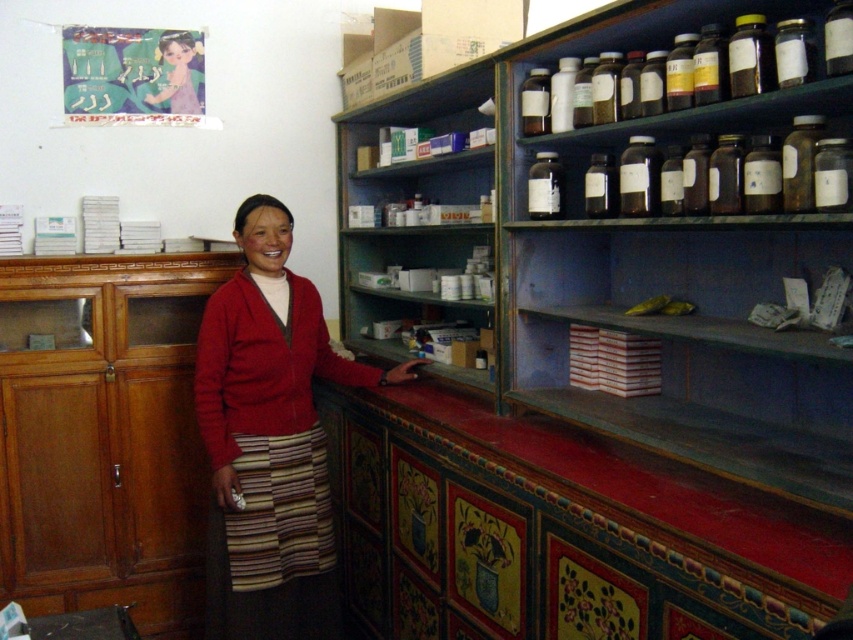
You are a customer in the pharmacy and want to reach both the point at (241, 348) and the point at (817, 112). Which point should you approach first to minimize walking distance?

You should approach point (241, 348) first because it is closer to you than point (817, 112), which is further away.